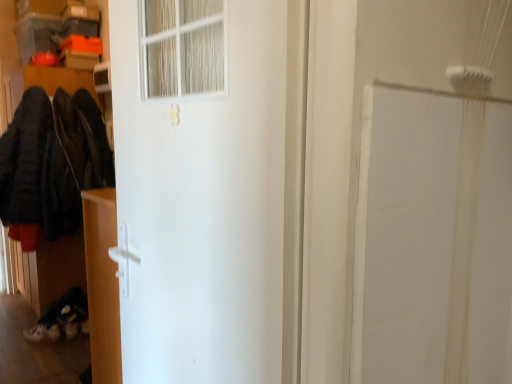
Question: Does white matte door at center have a lesser height compared to matte white cabinet at lower left?

Choices:
 (A) yes
 (B) no

Answer: (B)

Question: Is white matte door at center positioned behind matte white cabinet at lower left?

Choices:
 (A) yes
 (B) no

Answer: (B)

Question: From a real-world perspective, does white matte door at center stand above matte white cabinet at lower left?

Choices:
 (A) yes
 (B) no

Answer: (A)

Question: Is white matte door at center not close to matte white cabinet at lower left?

Choices:
 (A) yes
 (B) no

Answer: (B)

Question: Is white matte door at center not within matte white cabinet at lower left?

Choices:
 (A) yes
 (B) no

Answer: (A)

Question: From the image's perspective, is dark woolen coat at left located above or below matte white cabinet at lower left?

Choices:
 (A) below
 (B) above

Answer: (B)

Question: Relative to matte white cabinet at lower left, is dark woolen coat at left in front or behind?

Choices:
 (A) front
 (B) behind

Answer: (B)

Question: Would you say dark woolen coat at left is inside or outside matte white cabinet at lower left?

Choices:
 (A) inside
 (B) outside

Answer: (B)

Question: Considering the positions of point (110, 150) and point (93, 350), is point (110, 150) closer or farther from the camera than point (93, 350)?

Choices:
 (A) farther
 (B) closer

Answer: (A)

Question: Considering the positions of point (94, 291) and point (11, 170), is point (94, 291) closer or farther from the camera than point (11, 170)?

Choices:
 (A) closer
 (B) farther

Answer: (A)

Question: Considering the positions of matte white cabinet at lower left and dark woolen coat at left in the image, is matte white cabinet at lower left taller or shorter than dark woolen coat at left?

Choices:
 (A) short
 (B) tall

Answer: (A)

Question: From the image's perspective, is matte white cabinet at lower left above or below dark woolen coat at left?

Choices:
 (A) above
 (B) below

Answer: (B)

Question: Considering their positions, is matte white cabinet at lower left located in front of or behind dark woolen coat at left?

Choices:
 (A) front
 (B) behind

Answer: (A)

Question: Considering the positions of white matte door at center and matte white cabinet at lower left in the image, is white matte door at center wider or thinner than matte white cabinet at lower left?

Choices:
 (A) thin
 (B) wide

Answer: (A)

Question: Considering the positions of white matte door at center and matte white cabinet at lower left in the image, is white matte door at center taller or shorter than matte white cabinet at lower left?

Choices:
 (A) tall
 (B) short

Answer: (A)